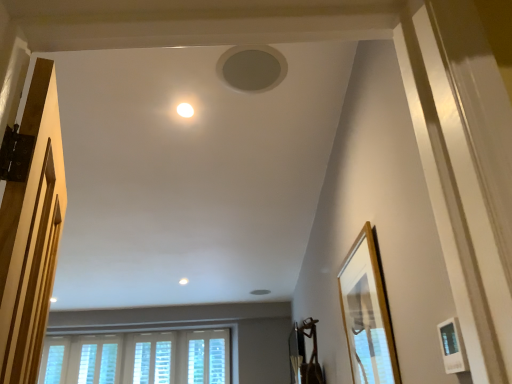
Question: Which direction should I rotate to face white matte hole at upper center, positioned as the second hole in front-to-back order, — up or down?

Choices:
 (A) down
 (B) up

Answer: (A)

Question: Is white glossy light fixture at upper center further to the viewer compared to white matte picture frame at lower right, arranged as the 2th picture frame when viewed from the back?

Choices:
 (A) no
 (B) yes

Answer: (B)

Question: Is white glossy light fixture at upper center placed right next to white matte picture frame at lower right, arranged as the 2th picture frame when viewed from the back?

Choices:
 (A) no
 (B) yes

Answer: (A)

Question: Considering the relative sizes of white glossy light fixture at upper center and white matte picture frame at lower right, arranged as the 2th picture frame when viewed from the back, in the image provided, is white glossy light fixture at upper center smaller than white matte picture frame at lower right, arranged as the 2th picture frame when viewed from the back,?

Choices:
 (A) no
 (B) yes

Answer: (B)

Question: Considering the relative sizes of white glossy light fixture at upper center and white matte picture frame at lower right, which ranks as the 1th picture frame in front-to-back order, in the image provided, is white glossy light fixture at upper center thinner than white matte picture frame at lower right, which ranks as the 1th picture frame in front-to-back order,?

Choices:
 (A) yes
 (B) no

Answer: (B)

Question: Is white matte picture frame at lower right, which ranks as the 1th picture frame in front-to-back order, at the back of white glossy light fixture at upper center?

Choices:
 (A) yes
 (B) no

Answer: (B)

Question: From a real-world perspective, is white glossy light fixture at upper center over white matte picture frame at lower right, arranged as the 2th picture frame when viewed from the back?

Choices:
 (A) yes
 (B) no

Answer: (A)

Question: Considering the relative positions of white textured window at lower center, arranged as the 1th window when viewed from the right, and white matte picture frame at lower right, which ranks as the 1th picture frame in front-to-back order, in the image provided, is white textured window at lower center, arranged as the 1th window when viewed from the right, behind white matte picture frame at lower right, which ranks as the 1th picture frame in front-to-back order,?

Choices:
 (A) no
 (B) yes

Answer: (B)

Question: Does white textured window at lower center, arranged as the 1th window when viewed from the right, have a smaller size compared to white matte picture frame at lower right, which ranks as the 1th picture frame in front-to-back order?

Choices:
 (A) no
 (B) yes

Answer: (A)

Question: Can you confirm if white textured window at lower center, acting as the fourth window starting from the left, is positioned to the right of white matte picture frame at lower right, which ranks as the 1th picture frame in front-to-back order?

Choices:
 (A) no
 (B) yes

Answer: (A)

Question: From a real-world perspective, is white textured window at lower center, acting as the fourth window starting from the left, physically above white matte picture frame at lower right, which ranks as the 1th picture frame in front-to-back order?

Choices:
 (A) no
 (B) yes

Answer: (B)

Question: Considering the relative sizes of white textured window at lower center, acting as the fourth window starting from the left, and white matte picture frame at lower right, arranged as the 2th picture frame when viewed from the back, in the image provided, is white textured window at lower center, acting as the fourth window starting from the left, wider than white matte picture frame at lower right, arranged as the 2th picture frame when viewed from the back,?

Choices:
 (A) no
 (B) yes

Answer: (B)

Question: Is white textured window at lower center, acting as the fourth window starting from the left, looking in the opposite direction of white matte picture frame at lower right, arranged as the 2th picture frame when viewed from the back?

Choices:
 (A) yes
 (B) no

Answer: (B)

Question: Is white textured window at lower left, which ranks as the third window in right-to-left order, at the right side of white textured blinds at lower center, which ranks as the 2th window in right-to-left order?

Choices:
 (A) yes
 (B) no

Answer: (B)